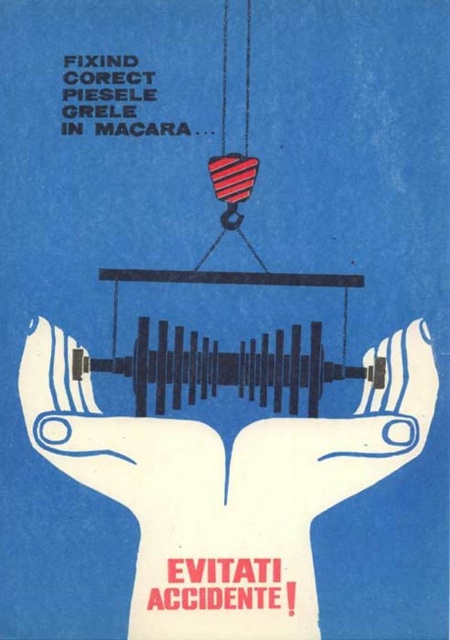
Who is taller, white matte hands at center or white matte hand at center?

With more height is white matte hands at center.

Image resolution: width=450 pixels, height=640 pixels. In order to click on white matte hands at center in this screenshot , I will do `click(226, 486)`.